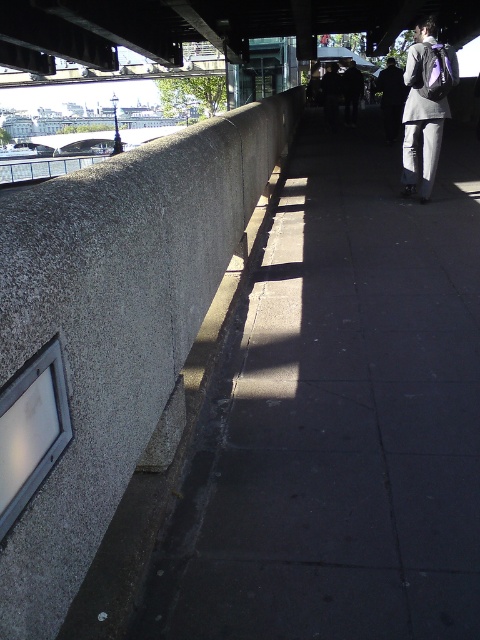
Question: Which point is farther to the camera?

Choices:
 (A) (380, 451)
 (B) (415, 180)

Answer: (B)

Question: Which object is closer to the camera taking this photo?

Choices:
 (A) gray concrete ledge at left
 (B) gray concrete pavement at center

Answer: (B)

Question: Is gray concrete pavement at center thinner than gray fabric backpack at right?

Choices:
 (A) no
 (B) yes

Answer: (A)

Question: Can you confirm if gray concrete pavement at center is positioned to the left of gray concrete ledge at left?

Choices:
 (A) yes
 (B) no

Answer: (B)

Question: Does gray concrete ledge at left come behind gray fabric backpack at right?

Choices:
 (A) no
 (B) yes

Answer: (A)

Question: Which object appears closest to the camera in this image?

Choices:
 (A) gray concrete pavement at center
 (B) gray fabric backpack at right

Answer: (A)